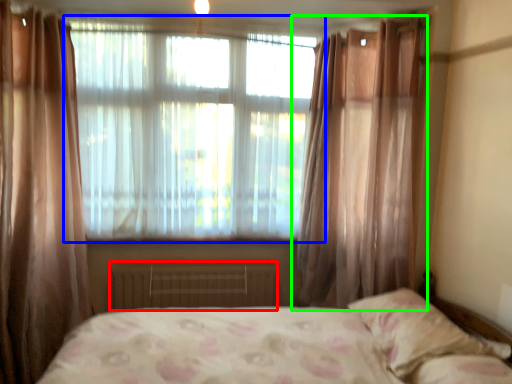
Question: Based on their relative distances, which object is farther from radiator (highlighted by a red box)? Choose from window (highlighted by a blue box) and curtain (highlighted by a green box).

Choices:
 (A) window
 (B) curtain

Answer: (B)